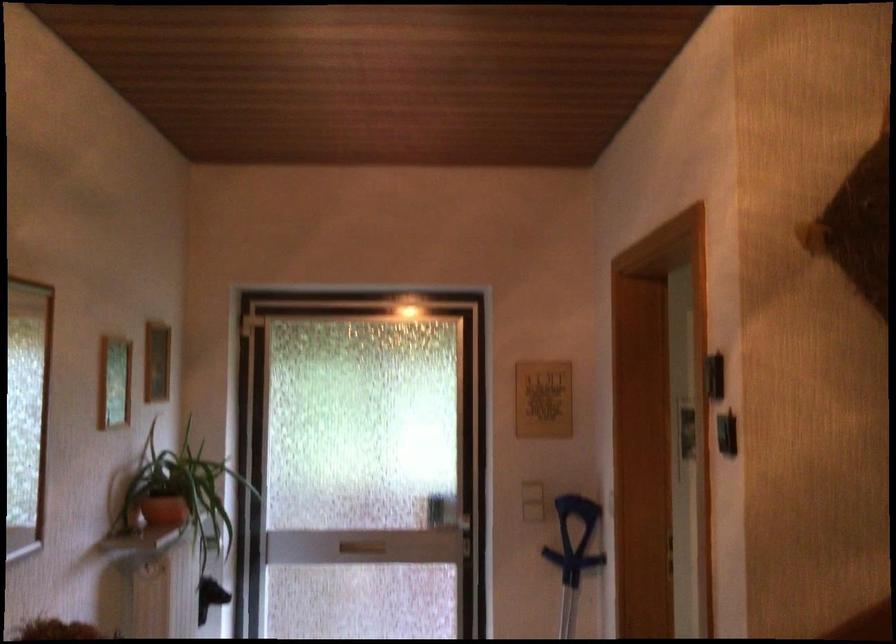
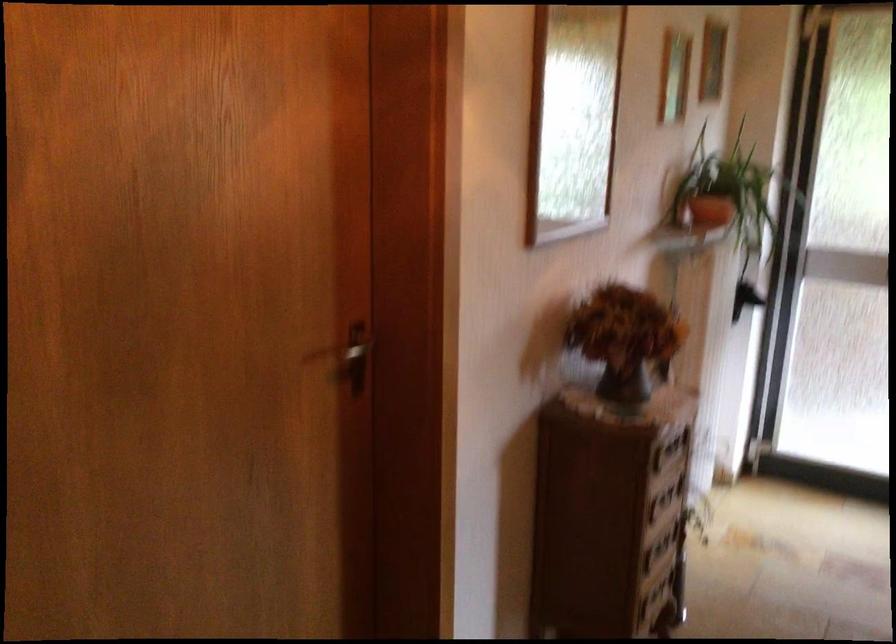
Find the pixel in the second image that matches pixel 167 515 in the first image.

(711, 211)